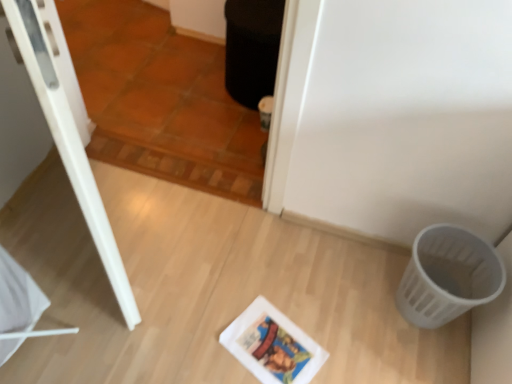
Identify the location of free space to the back side of matte white comic book at center. (278, 288).